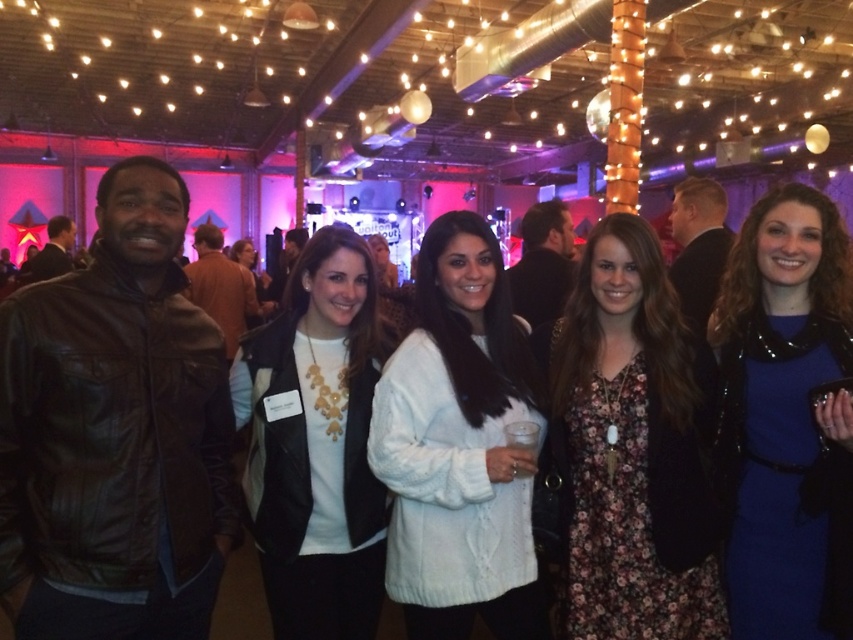
Who is more forward, (601, 584) or (254, 288)?

Point (601, 584) is in front.

Between point (592, 442) and point (258, 316), which one is positioned behind?

Point (258, 316)

You are a GUI agent. You are given a task and a screenshot of the screen. Output one action in this format:
    pyautogui.click(x=<x>, y=<y>)
    Task: Click on the floral dress at center
    The width and height of the screenshot is (853, 640).
    Given the screenshot: What is the action you would take?
    pyautogui.click(x=630, y=449)

Is blue satin dress at center to the right of white knitted sweater at center from the viewer's perspective?

Correct, you'll find blue satin dress at center to the right of white knitted sweater at center.

Is blue satin dress at center below white knitted sweater at center?

No, blue satin dress at center is not below white knitted sweater at center.

Is point (717, 470) behind point (421, 465)?

Yes.

Identify the location of blue satin dress at center. (786, 419).

Is point (479, 381) positioned before point (254, 314)?

Yes, it is in front of point (254, 314).

Can you confirm if white knitted sweater at center is taller than matte gold necklace at center?

Correct, white knitted sweater at center is much taller as matte gold necklace at center.

Image resolution: width=853 pixels, height=640 pixels. I want to click on white knitted sweater at center, so click(x=459, y=445).

Where is `white knitted sweater at center`? The image size is (853, 640). white knitted sweater at center is located at coordinates (459, 445).